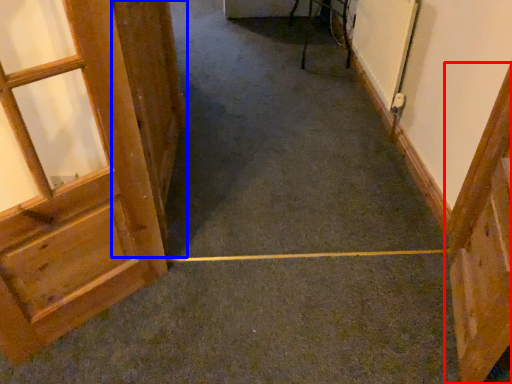
Question: Which of the following is the farthest to the observer, door (highlighted by a red box) or door (highlighted by a blue box)?

Choices:
 (A) door
 (B) door

Answer: (B)